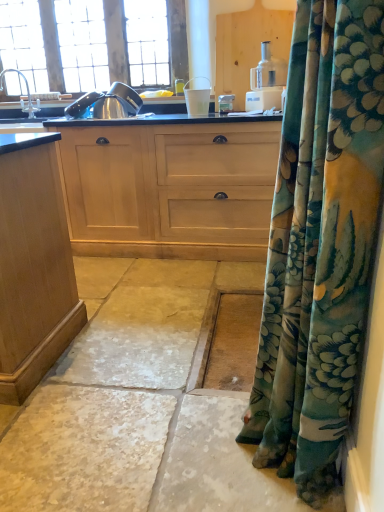
Question: Is satin nickel faucet at upper left not close to light wood cabinet at center?

Choices:
 (A) no
 (B) yes

Answer: (B)

Question: Is satin nickel faucet at upper left oriented away from light wood cabinet at center?

Choices:
 (A) no
 (B) yes

Answer: (A)

Question: Does satin nickel faucet at upper left have a larger size compared to light wood cabinet at center?

Choices:
 (A) yes
 (B) no

Answer: (B)

Question: Are satin nickel faucet at upper left and light wood cabinet at center beside each other?

Choices:
 (A) yes
 (B) no

Answer: (B)

Question: Considering the relative sizes of satin nickel faucet at upper left and light wood cabinet at center in the image provided, is satin nickel faucet at upper left shorter than light wood cabinet at center?

Choices:
 (A) yes
 (B) no

Answer: (A)

Question: From a real-world perspective, is white stone floor at lower center above or below satin nickel faucet at upper left?

Choices:
 (A) below
 (B) above

Answer: (A)

Question: Choose the correct answer: Is white stone floor at lower center inside satin nickel faucet at upper left or outside it?

Choices:
 (A) inside
 (B) outside

Answer: (B)

Question: Is white stone floor at lower center to the left or to the right of satin nickel faucet at upper left in the image?

Choices:
 (A) left
 (B) right

Answer: (B)

Question: From the image's perspective, relative to satin nickel faucet at upper left, is white stone floor at lower center above or below?

Choices:
 (A) above
 (B) below

Answer: (B)

Question: From a real-world perspective, is wooden window at upper left physically located above or below satin nickel faucet at upper left?

Choices:
 (A) above
 (B) below

Answer: (A)

Question: In the image, is wooden window at upper left positioned in front of or behind satin nickel faucet at upper left?

Choices:
 (A) behind
 (B) front

Answer: (A)

Question: Would you say wooden window at upper left is inside or outside satin nickel faucet at upper left?

Choices:
 (A) inside
 (B) outside

Answer: (B)

Question: From the image's perspective, is wooden window at upper left positioned above or below satin nickel faucet at upper left?

Choices:
 (A) above
 (B) below

Answer: (A)

Question: Is white plastic food processor at upper center to the left or to the right of wooden window at upper left in the image?

Choices:
 (A) right
 (B) left

Answer: (A)

Question: Considering the positions of white plastic food processor at upper center and wooden window at upper left in the image, is white plastic food processor at upper center taller or shorter than wooden window at upper left?

Choices:
 (A) short
 (B) tall

Answer: (A)